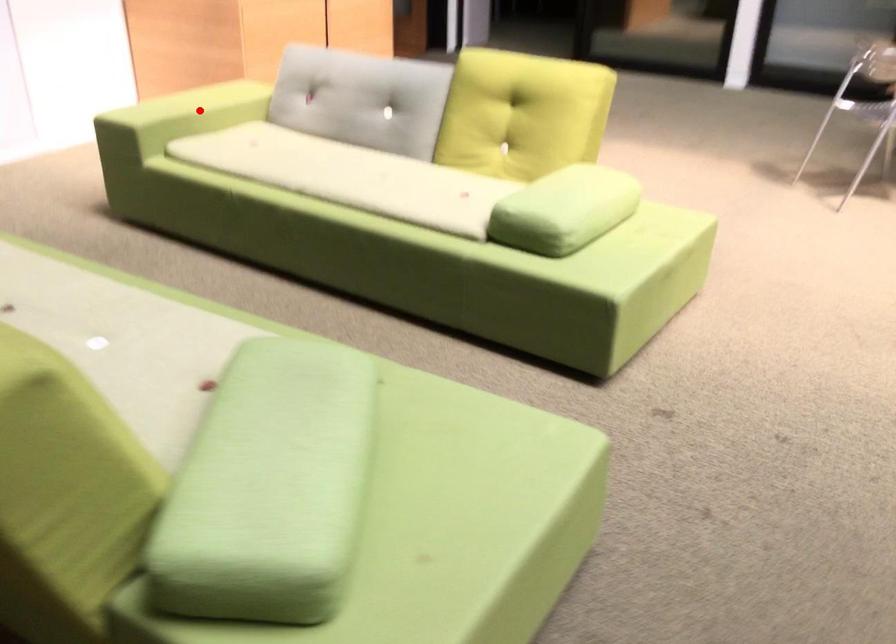
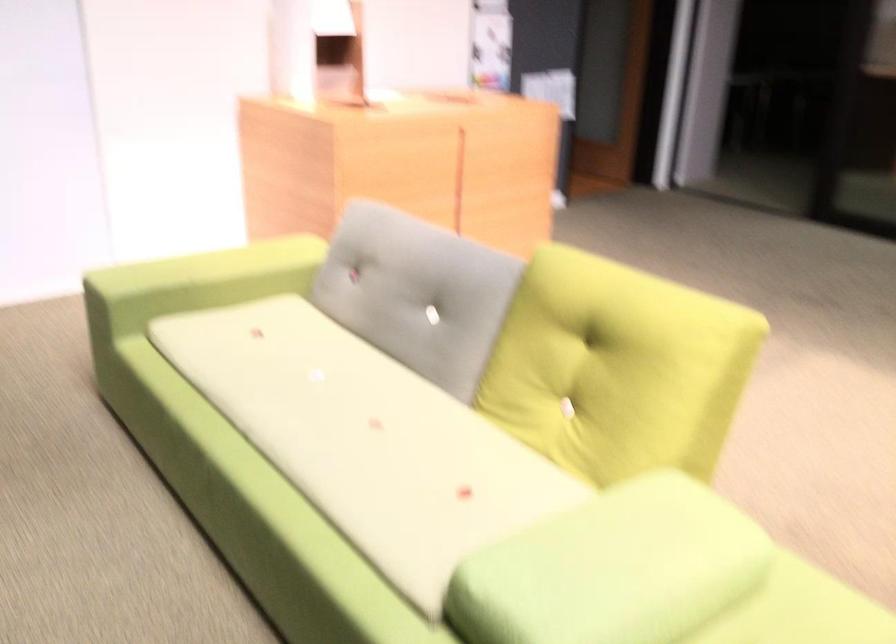
Question: A red point is marked in image1. In image2, is the corresponding 3D point closer to the camera or farther? Reply with the corresponding letter.

Choices:
 (A) The corresponding 3D point is closer.
 (B) The corresponding 3D point is farther.

Answer: (A)